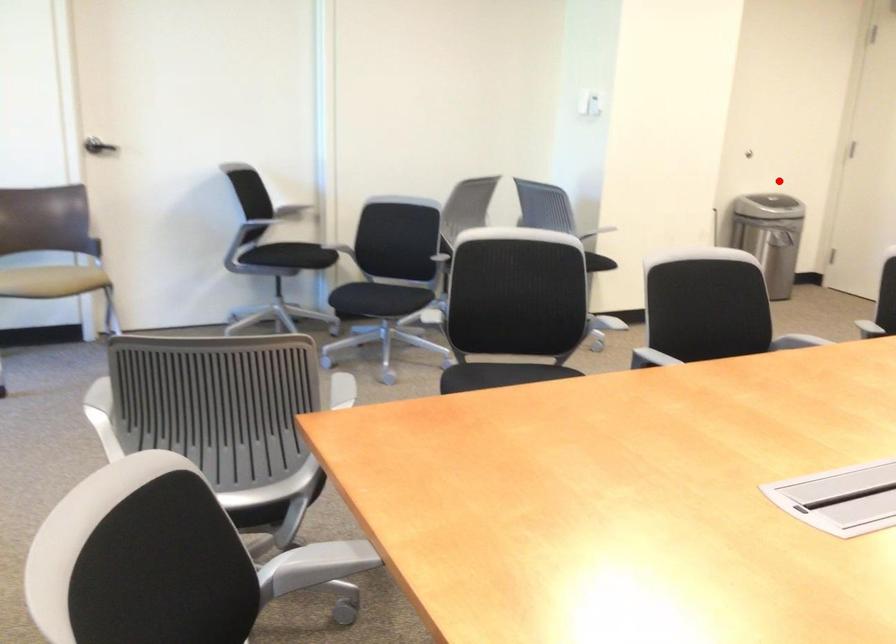
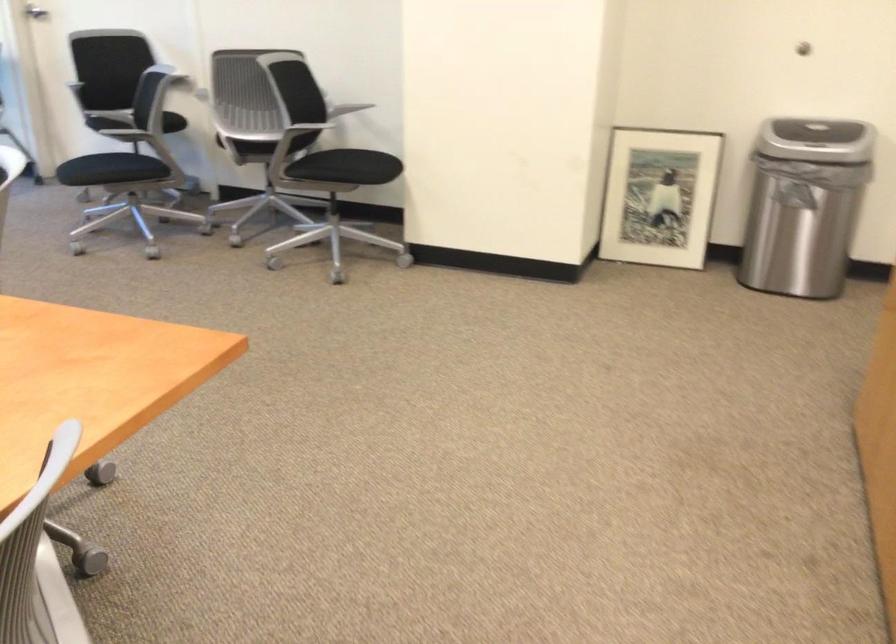
Where in the second image is the point corresponding to the highlighted location from the first image?

(821, 131)